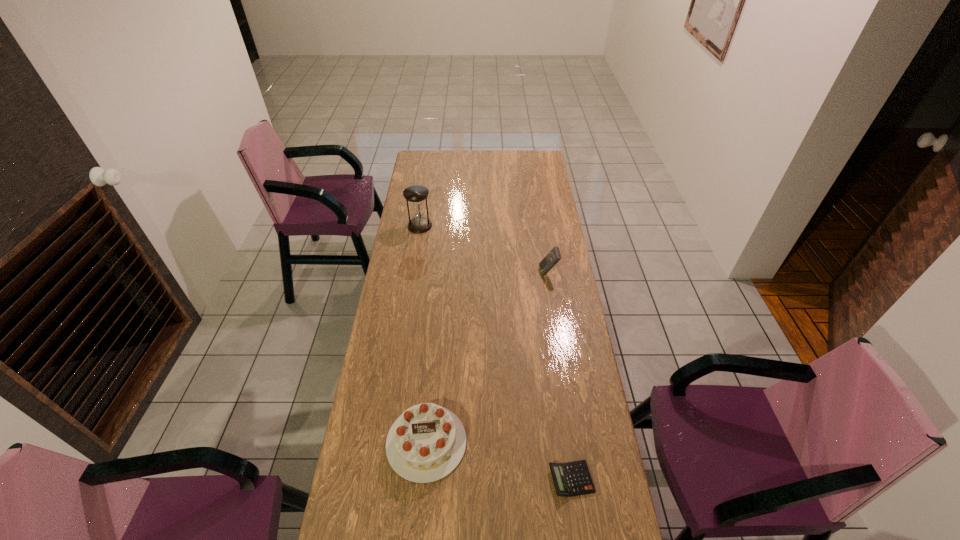
At what (x,y) coordinates should I click in order to perform the action: click on vacant space that's between the hourglass and the birthday cake. Please return your answer as a coordinate pair (x, y). This screenshot has height=540, width=960. Looking at the image, I should click on (423, 334).

Image resolution: width=960 pixels, height=540 pixels. I want to click on vacant space that is in between the nearer calculator and the third shortest object, so click(560, 376).

Locate an element on the screen. The width and height of the screenshot is (960, 540). vacant area between the farthest object and the third tallest object is located at coordinates (423, 334).

Where is `unoccupied position between the third tallest object and the hourglass`? The height and width of the screenshot is (540, 960). unoccupied position between the third tallest object and the hourglass is located at coordinates (x=423, y=334).

Find the location of a particular element. Image resolution: width=960 pixels, height=540 pixels. vacant area that lies between the shortest object and the second shortest object is located at coordinates (499, 461).

This screenshot has width=960, height=540. I want to click on free space between the birthday cake and the second farthest object, so click(x=488, y=357).

At what (x,y) coordinates should I click in order to perform the action: click on vacant area that lies between the second tallest object and the nearer calculator. Please return your answer as a coordinate pair (x, y). Image resolution: width=960 pixels, height=540 pixels. Looking at the image, I should click on (560, 376).

Identify the location of free point between the shortest object and the birthday cake. The width and height of the screenshot is (960, 540). (499, 461).

Where is `the second closest object to the birthday cake`? Image resolution: width=960 pixels, height=540 pixels. the second closest object to the birthday cake is located at coordinates (551, 259).

Image resolution: width=960 pixels, height=540 pixels. I want to click on the closest object to the shorter calculator, so click(x=426, y=443).